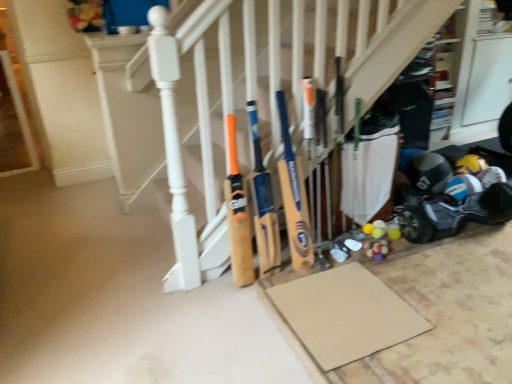
I want to click on vacant space in front of blue plastic baby carriage at lower right, so click(x=465, y=264).